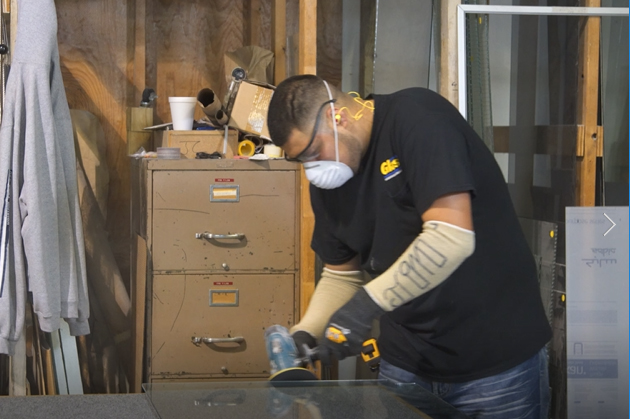
The image size is (630, 419). What are the coordinates of `cabinet` in the screenshot? It's located at point(178,263).